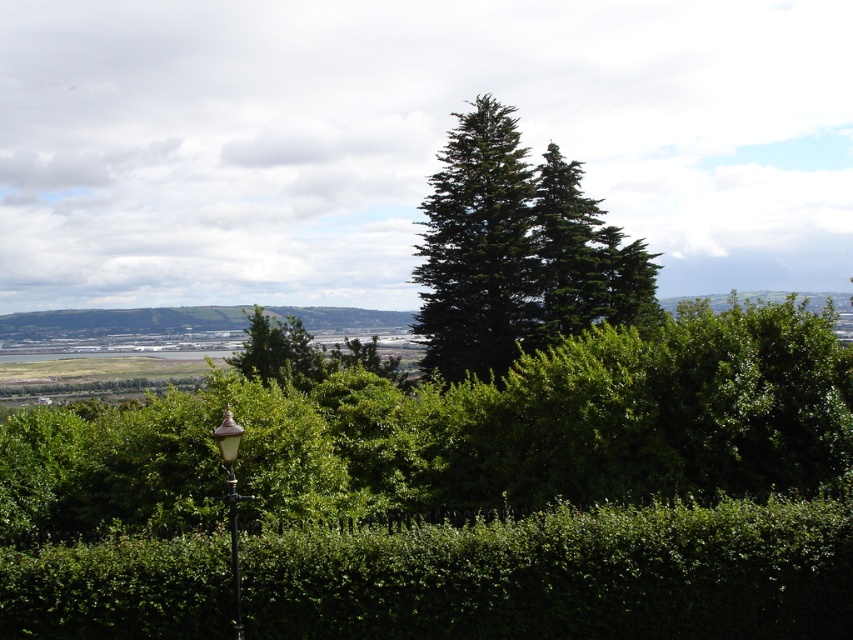
Is green leafy tree at center thinner than green glass lamp post at lower left?

In fact, green leafy tree at center might be wider than green glass lamp post at lower left.

This screenshot has height=640, width=853. What do you see at coordinates (280, 352) in the screenshot? I see `green leafy tree at center` at bounding box center [280, 352].

Describe the element at coordinates (280, 352) in the screenshot. I see `green leafy tree at center` at that location.

The image size is (853, 640). I want to click on green leafy tree at center, so click(280, 352).

Is green leafy hedge at center wider than green needle-like at center?

Yes.

Between green leafy hedge at center and green needle-like at center, which one appears on the left side from the viewer's perspective?

green leafy hedge at center is more to the left.

Between point (178, 536) and point (476, 228), which one is positioned behind?

The point (476, 228) is behind.

Where is `green leafy hedge at center`? green leafy hedge at center is located at coordinates (564, 573).

Can you confirm if green leafy hedge at center is shorter than green leafy tree at center?

Indeed, green leafy hedge at center has a lesser height compared to green leafy tree at center.

Can you confirm if green leafy hedge at center is wider than green leafy tree at center?

Indeed, green leafy hedge at center has a greater width compared to green leafy tree at center.

Who is more forward, (64, 632) or (289, 353)?

Point (64, 632) is more forward.

Identify the location of green leafy hedge at center. This screenshot has height=640, width=853. (564, 573).